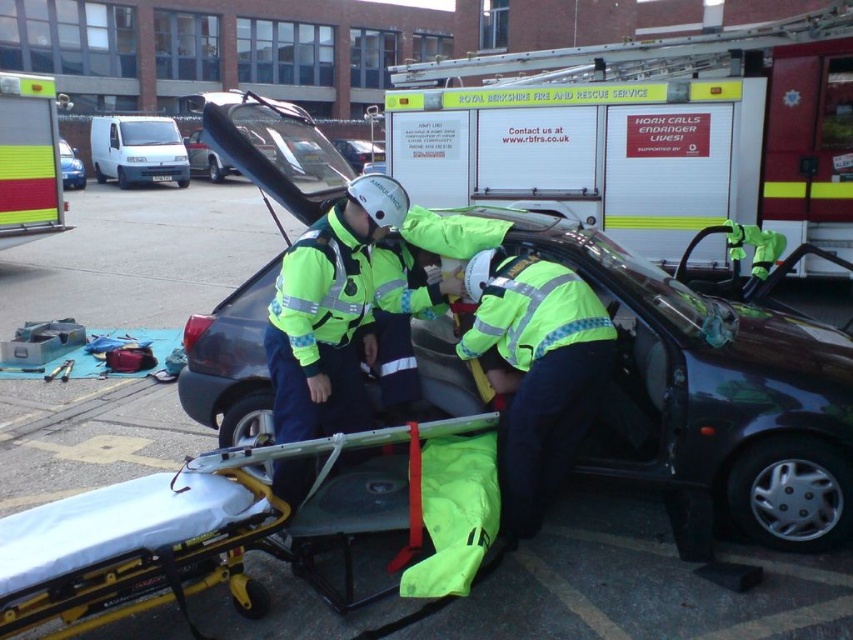
You are a paramedic arriving at the scene of an accident. You need to quickly transport a patient using the yellow metallic stretcher at lower left. However, you also see the white matte van at upper left nearby. Can the stretcher fit inside the van? Please explain your reasoning based on the objects provided.

The yellow metallic stretcher at lower left has a smaller size compared to white matte van at upper left, so the stretcher can fit inside the van as it is smaller than the van.

You are a paramedic arriving at the scene of an accident. You need to quickly access the blue matte car at left. Is the yellow metallic stretcher at lower left blocking your path to the car?

The yellow metallic stretcher at lower left is in front of the blue matte car at left, so it is blocking the path to the car.